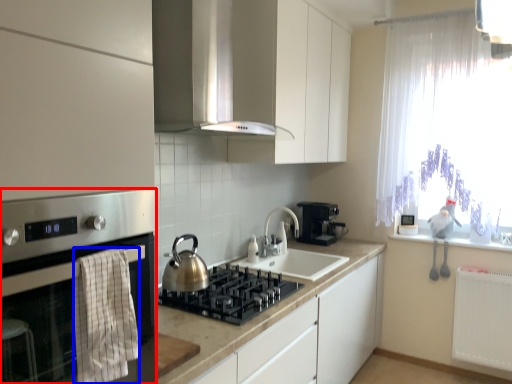
Question: Among these objects, which one is farthest to the camera, home appliance (highlighted by a red box) or blanket (highlighted by a blue box)?

Choices:
 (A) home appliance
 (B) blanket

Answer: (B)